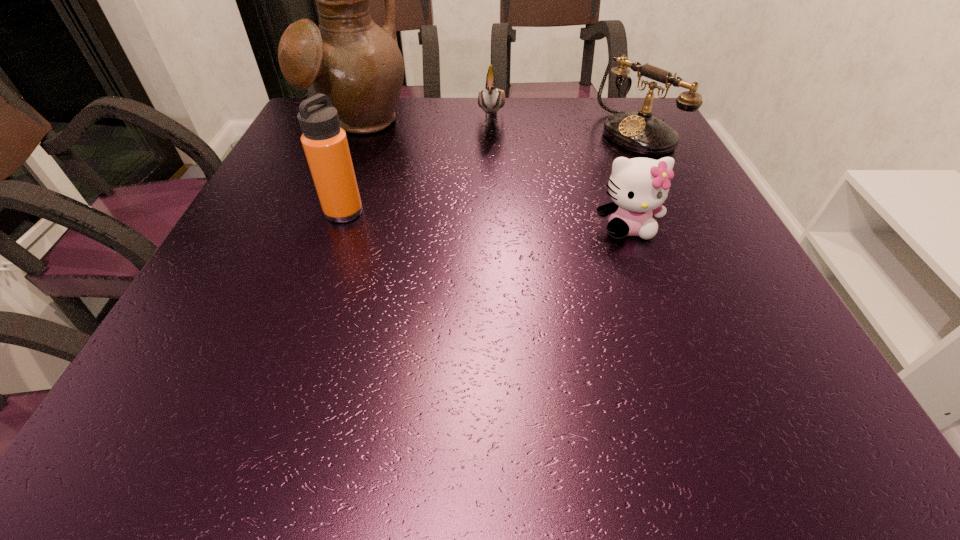
Find the location of `vacant space on the desktop that is between the thermos bottle and the kitten and is positioned at the spout of the pitcher`. vacant space on the desktop that is between the thermos bottle and the kitten and is positioned at the spout of the pitcher is located at coordinates click(x=469, y=219).

Where is `free spot on the desktop that is between the thermos bottle and the kitten and is positioned at the face of the third object from left to right`? The height and width of the screenshot is (540, 960). free spot on the desktop that is between the thermos bottle and the kitten and is positioned at the face of the third object from left to right is located at coordinates (480, 219).

Image resolution: width=960 pixels, height=540 pixels. I want to click on vacant space on the desktop that is between the fourth shortest object and the kitten and is positioned on the dial of the telephone, so click(468, 219).